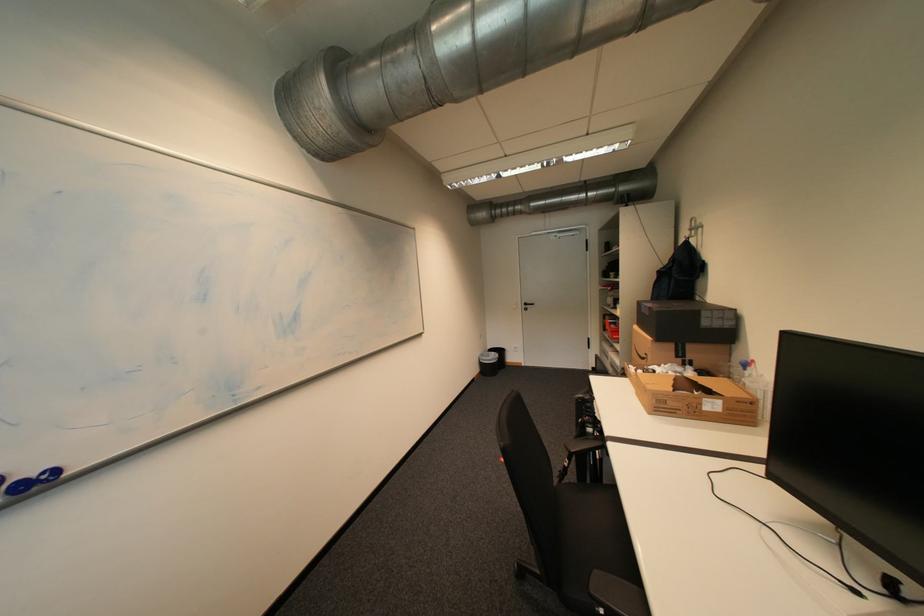
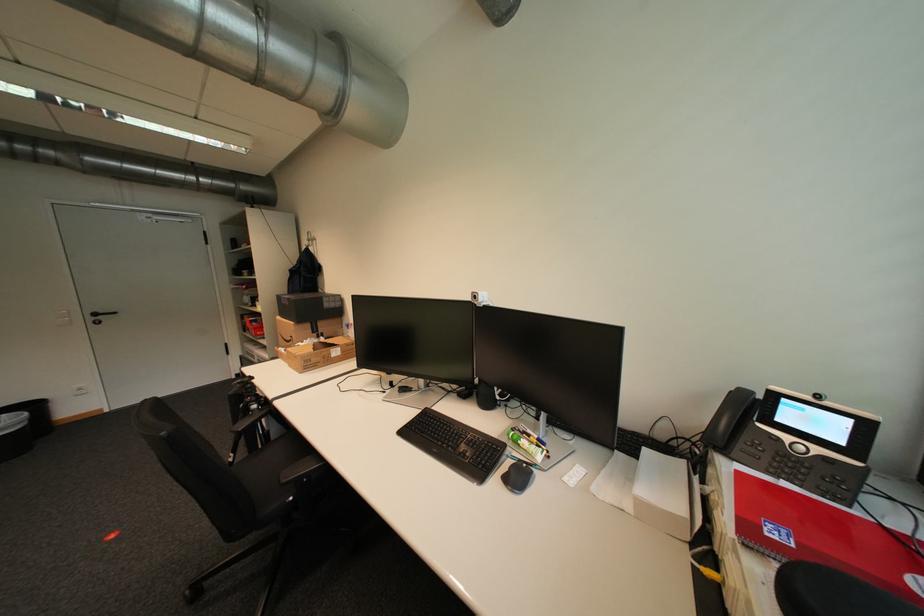
In the second image, find the point that corresponds to [674,408] in the first image.

(319, 365)